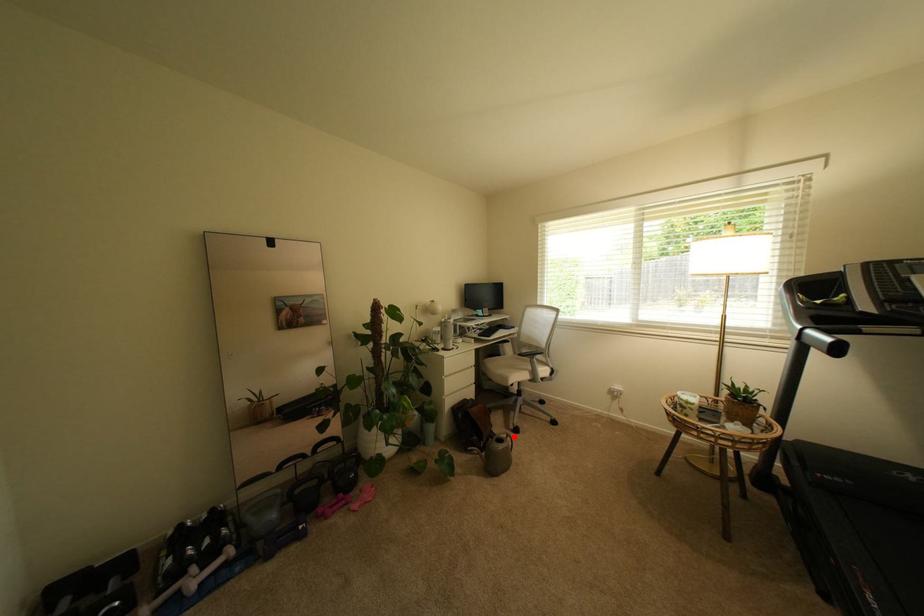
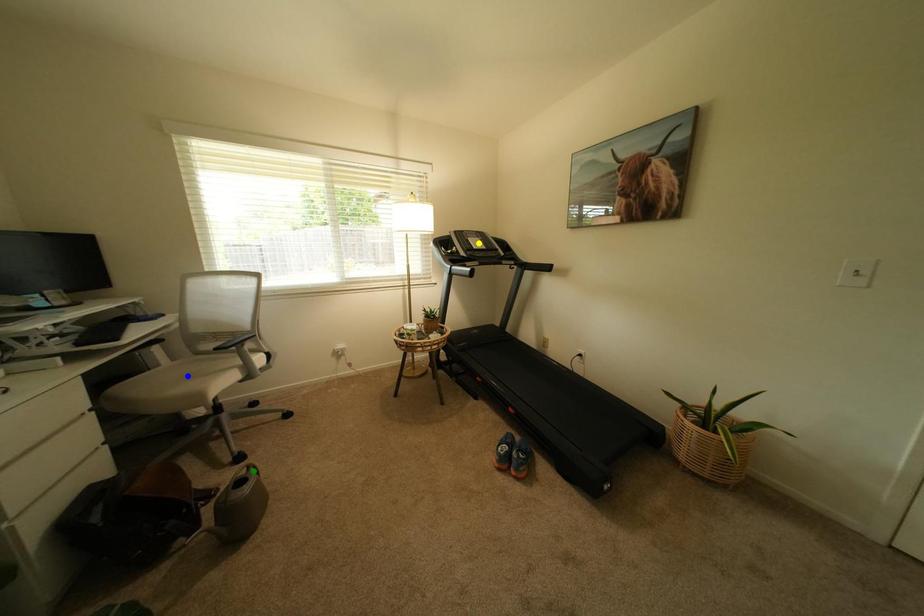
Question: I am providing you with two images of the same scene from different viewpoints. A red point is marked on the first image. You are given multiple points on the second image. Can you choose the point in image 2 that corresponds to the point in image 1?

Choices:
 (A) green point
 (B) yellow point
 (C) blue point

Answer: (A)